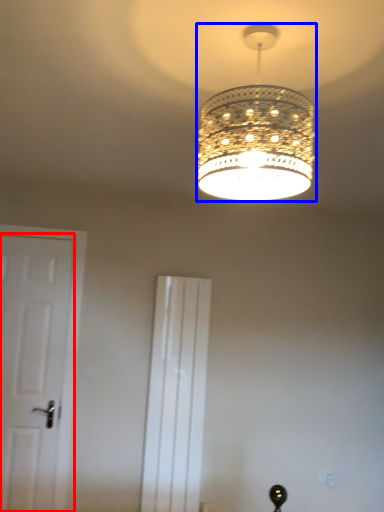
Question: Which object appears closest to the camera in this image, door (highlighted by a red box) or lamp (highlighted by a blue box)?

Choices:
 (A) door
 (B) lamp

Answer: (B)